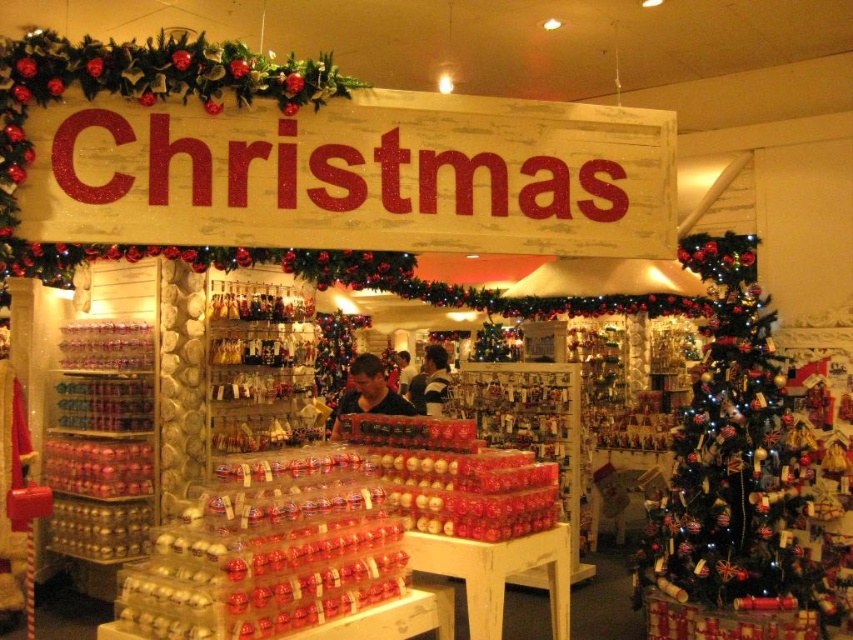
Question: Does shiny metallic ornament at center have a greater width compared to matte black shirt at center?

Choices:
 (A) no
 (B) yes

Answer: (B)

Question: Among these points, which one is farthest from the camera?

Choices:
 (A) (786, 433)
 (B) (363, 356)

Answer: (B)

Question: Does shiny metallic ornament at center appear under matte black shirt at center?

Choices:
 (A) yes
 (B) no

Answer: (A)

Question: Which point is closer to the camera taking this photo?

Choices:
 (A) (735, 403)
 (B) (404, 404)

Answer: (A)

Question: Can you confirm if shiny metallic ornament at center is bigger than matte black shirt at center?

Choices:
 (A) no
 (B) yes

Answer: (B)